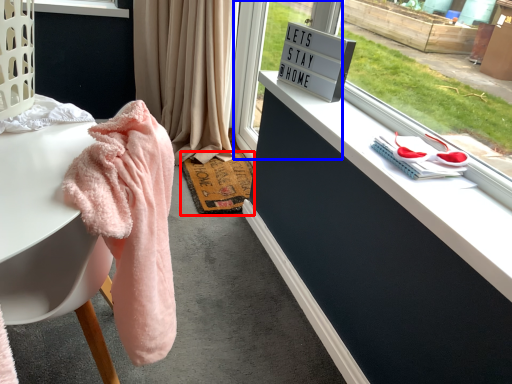
Question: Which point is further to the camera, mat (highlighted by a red box) or glass door (highlighted by a blue box)?

Choices:
 (A) mat
 (B) glass door

Answer: (A)